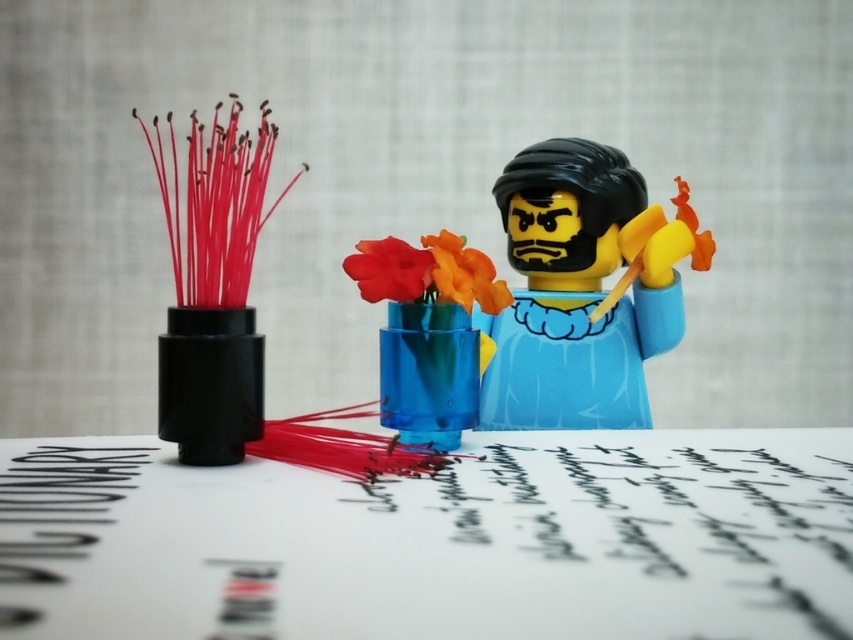
Based on the scene description, can you determine if the matte blue plastic figurine at center is wider than the orange matte flower at center?

The matte blue plastic figurine at center might be wider than orange matte flower at center according to the description.

You are organizing a small display for a craft fair. You have a matte blue plastic figurine at center and an orange matte flower at center. Which object should you place in the foreground to ensure it stands out more visually?

The matte blue plastic figurine at center should be placed in the foreground because it is larger than the orange matte flower at center, making it more noticeable.

You are a photographer trying to capture the orange matte flower at center without the matte blue plastic figurine at center blocking it. How can you adjust your position to achieve this?

The orange matte flower at center is behind the matte blue plastic figurine at center. To capture the orange matte flower at center without obstruction, move to a position where you can see around or behind the matte blue plastic figurine at center, ensuring the flower is in the frame while the figurine is not blocking it.